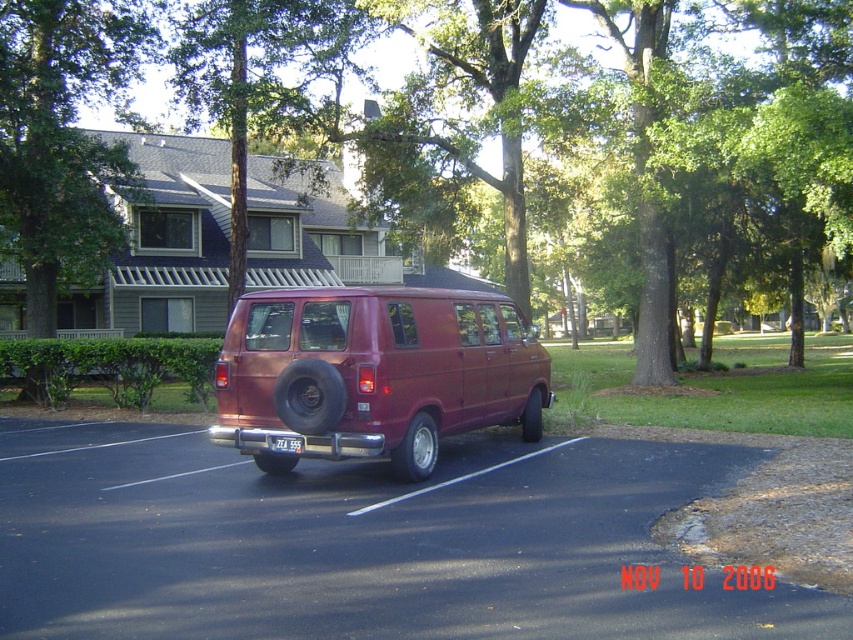
Can you confirm if satin burgundy van at center is positioned below white plastic license plate at center?

No, satin burgundy van at center is not below white plastic license plate at center.

Is point (386, 433) less distant than point (283, 440)?

Yes.

This screenshot has height=640, width=853. I want to click on satin burgundy van at center, so click(x=375, y=372).

Can you confirm if black asphalt parking lot at center is shorter than satin burgundy van at center?

Yes.

Between point (660, 465) and point (234, 340), which one is positioned in front?

Point (234, 340)

This screenshot has width=853, height=640. Identify the location of black asphalt parking lot at center. (364, 541).

At what (x,y) coordinates should I click in order to perform the action: click on black asphalt parking lot at center. Please return your answer as a coordinate pair (x, y). Looking at the image, I should click on (364, 541).

Does point (53, 36) come in front of point (289, 440)?

No, (53, 36) is behind (289, 440).

Is green leafy tree at upper left shorter than white plastic license plate at center?

Incorrect, green leafy tree at upper left's height does not fall short of white plastic license plate at center's.

This screenshot has width=853, height=640. What do you see at coordinates (62, 140) in the screenshot?
I see `green leafy tree at upper left` at bounding box center [62, 140].

At what (x,y) coordinates should I click in order to perform the action: click on green leafy tree at upper left. Please return your answer as a coordinate pair (x, y). The height and width of the screenshot is (640, 853). Looking at the image, I should click on (62, 140).